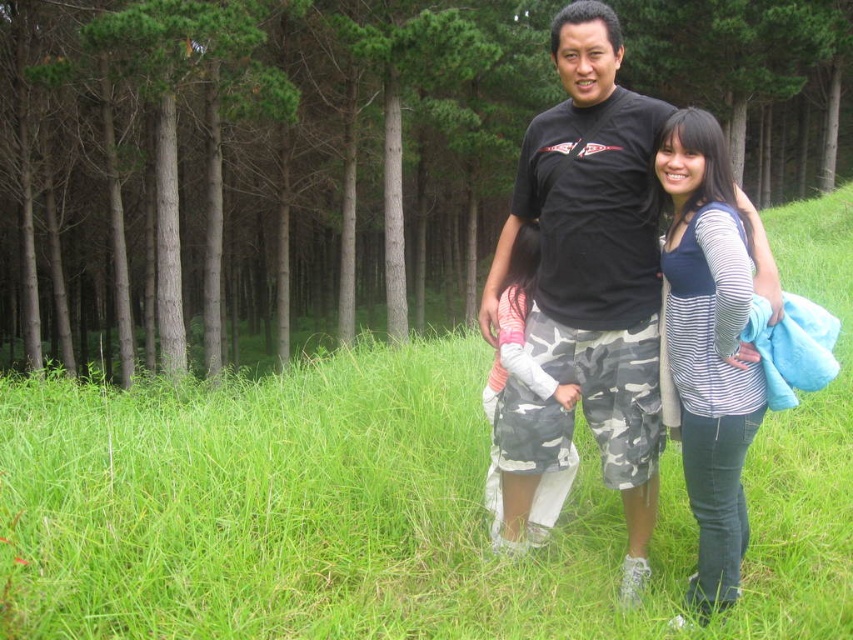
Question: Is green grassy field at center to the right of black matte t-shirt at center from the viewer's perspective?

Choices:
 (A) no
 (B) yes

Answer: (B)

Question: Is blue striped shirt at center bigger than camouflage pants at center?

Choices:
 (A) no
 (B) yes

Answer: (B)

Question: Which object is the farthest from the black matte t-shirt at center?

Choices:
 (A) green leafy tree at center
 (B) camouflage pants at center

Answer: (A)

Question: Considering the real-world distances, which object is farthest from the blue striped shirt at center?

Choices:
 (A) green leafy tree at center
 (B) black matte t-shirt at center

Answer: (A)

Question: Which object is the farthest from the green leafy tree at center?

Choices:
 (A) black matte t-shirt at center
 (B) green grassy field at center

Answer: (A)

Question: Is green grassy field at center below blue striped shirt at center?

Choices:
 (A) yes
 (B) no

Answer: (B)